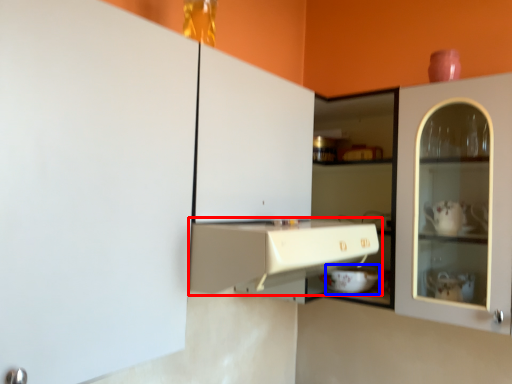
Question: Which object is further to the camera taking this photo, cabinetry (highlighted by a red box) or appliance (highlighted by a blue box)?

Choices:
 (A) cabinetry
 (B) appliance

Answer: (B)